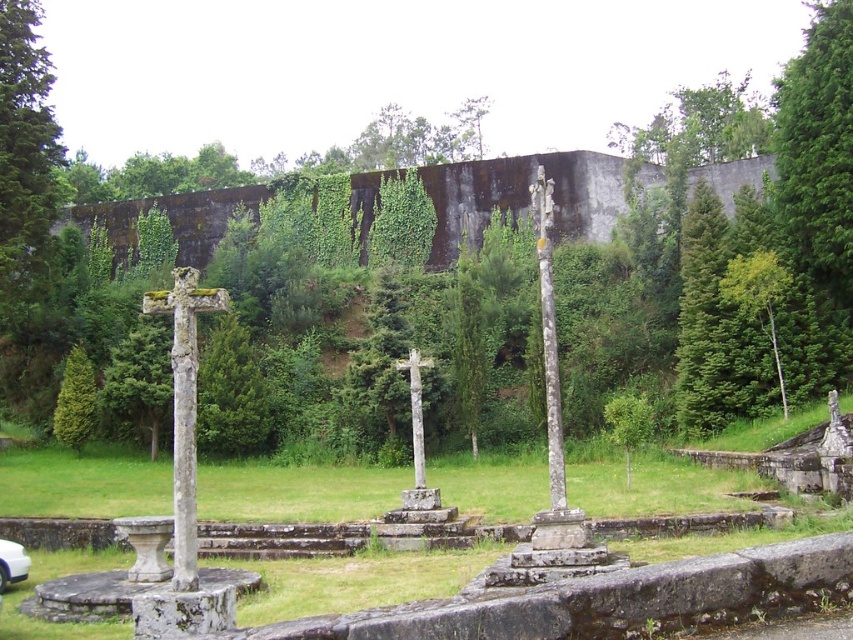
Question: Based on their relative distances, which object is farther from the green textured stone cross at lower left?

Choices:
 (A) green leafy tree at center
 (B) smooth gray stone pole at center
 (C) white stone cross at center
 (D) stone cross at left

Answer: (B)

Question: Which of the following is the farthest from the observer?

Choices:
 (A) green leafy tree at center
 (B) smooth gray stone pole at center
 (C) green leafy tree at upper right

Answer: (C)

Question: Does green leafy tree at center have a lesser width compared to white glossy car at lower left?

Choices:
 (A) yes
 (B) no

Answer: (B)

Question: Which of these objects is positioned farthest from the white glossy car at lower left?

Choices:
 (A) green leafy tree at upper right
 (B) smooth gray stone pole at center
 (C) green leafy tree at center

Answer: (C)

Question: Does smooth gray stone pole at center appear on the left side of green textured stone cross at lower left?

Choices:
 (A) yes
 (B) no

Answer: (B)

Question: Is green leafy tree at center wider than stone cross at left?

Choices:
 (A) no
 (B) yes

Answer: (B)